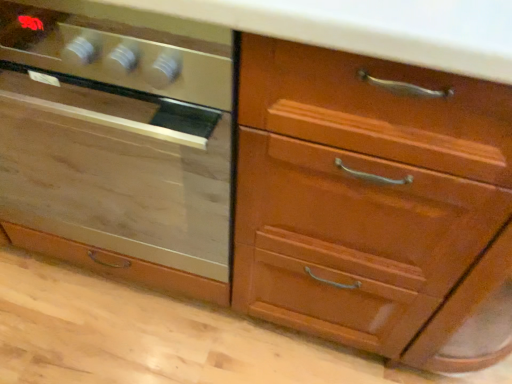
Locate an element on the screen. matte wood drawer at center is located at coordinates (117, 142).

The image size is (512, 384). What do you see at coordinates (117, 142) in the screenshot? I see `matte wood drawer at center` at bounding box center [117, 142].

You are a GUI agent. You are given a task and a screenshot of the screen. Output one action in this format:
    pyautogui.click(x=<x>, y=<y>)
    Task: Click on the matte wood drawer at center
    This screenshot has height=384, width=512.
    Given the screenshot: What is the action you would take?
    pyautogui.click(x=117, y=142)